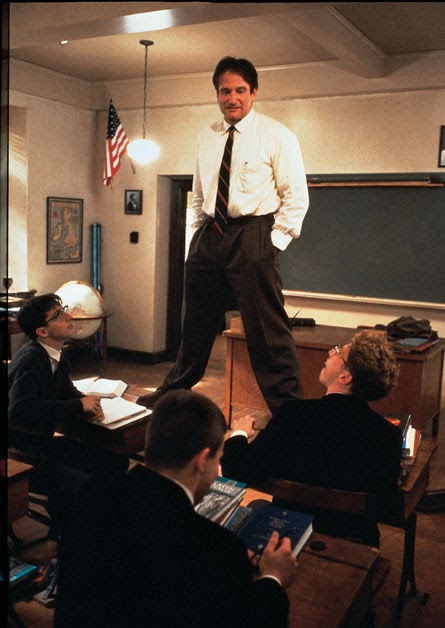
The height and width of the screenshot is (628, 445). I want to click on desks, so click(x=15, y=468), click(x=132, y=396), click(x=326, y=561), click(x=418, y=475), click(x=312, y=338).